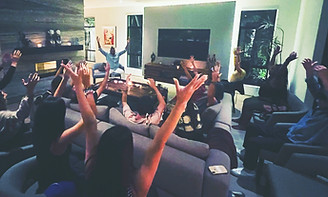
Identify the location of tv. The height and width of the screenshot is (197, 328). (185, 32).